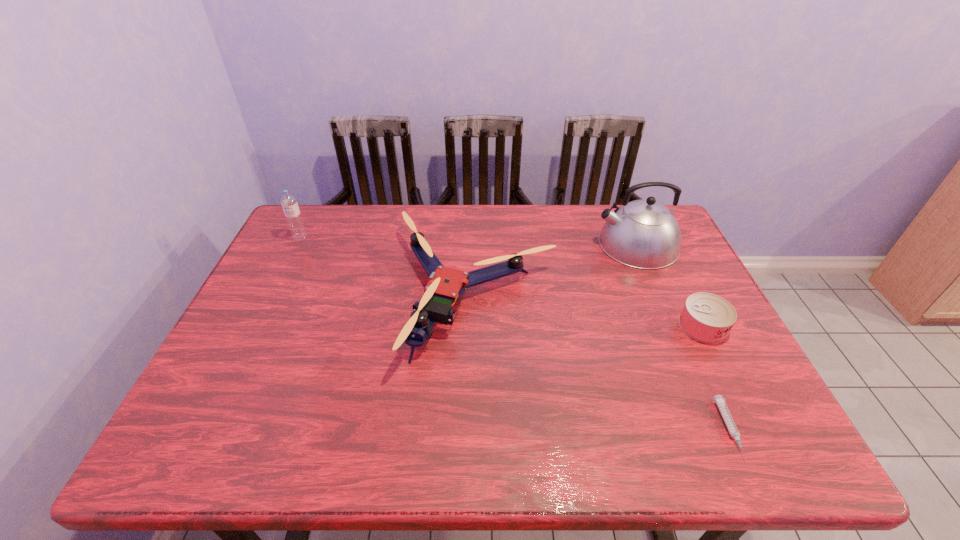
Identify the location of can situated at the right edge. (708, 318).

Where is `syringe situated at the right edge`? syringe situated at the right edge is located at coordinates (719, 400).

Image resolution: width=960 pixels, height=540 pixels. I want to click on object that is at the far left corner, so click(293, 216).

The image size is (960, 540). Find the location of `object that is at the far right corner`. object that is at the far right corner is located at coordinates (644, 234).

Image resolution: width=960 pixels, height=540 pixels. In order to click on object at the near right corner in this screenshot , I will do `click(719, 400)`.

Where is `vacant space at the far edge of the desktop`? The height and width of the screenshot is (540, 960). vacant space at the far edge of the desktop is located at coordinates (391, 212).

Image resolution: width=960 pixels, height=540 pixels. What are the coordinates of `vacant space at the near edge of the desktop` in the screenshot? It's located at (578, 442).

The width and height of the screenshot is (960, 540). Find the location of `free space at the left edge of the desktop`. free space at the left edge of the desktop is located at coordinates [265, 358].

Where is `free region at the far left corner of the desktop`? Image resolution: width=960 pixels, height=540 pixels. free region at the far left corner of the desktop is located at coordinates (333, 221).

At what (x,y) coordinates should I click in order to perform the action: click on blank region between the shortest object and the fourth tallest object. Please return your answer as a coordinate pair (x, y). Looking at the image, I should click on (716, 378).